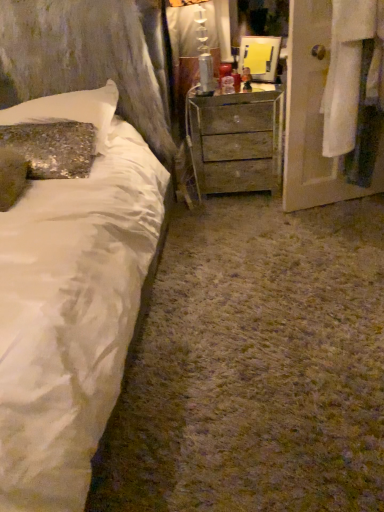
Find the location of a particular element. vacant space situated on the left part of white fabric door at right is located at coordinates (274, 228).